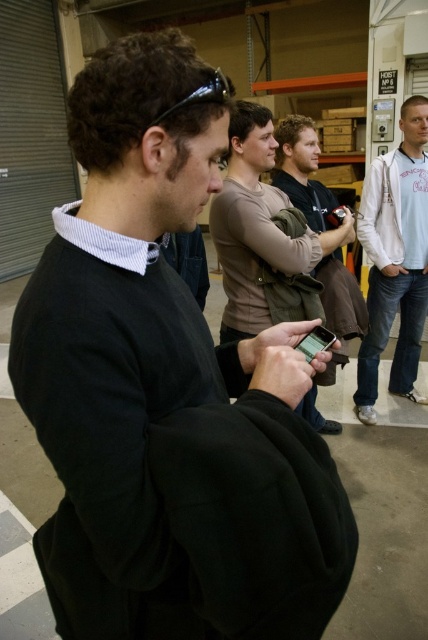
Can you confirm if white cotton jacket at right is shorter than brown leather jacket at center?

In fact, white cotton jacket at right may be taller than brown leather jacket at center.

Between point (363, 186) and point (303, 125), which one is positioned in front?

Point (303, 125) is more forward.

Locate an element on the screen. white cotton jacket at right is located at coordinates (395, 259).

In the scene shown: Is brown leather jacket at center below black glossy smartphone at center?

Actually, brown leather jacket at center is above black glossy smartphone at center.

Who is shorter, brown leather jacket at center or black glossy smartphone at center?

Standing shorter between the two is black glossy smartphone at center.

Where is `brown leather jacket at center`? Image resolution: width=428 pixels, height=640 pixels. brown leather jacket at center is located at coordinates (318, 224).

The width and height of the screenshot is (428, 640). What do you see at coordinates (395, 259) in the screenshot? I see `white cotton jacket at right` at bounding box center [395, 259].

Is point (412, 104) positioned after point (321, 342)?

That is True.

Image resolution: width=428 pixels, height=640 pixels. In order to click on white cotton jacket at right in this screenshot , I will do `click(395, 259)`.